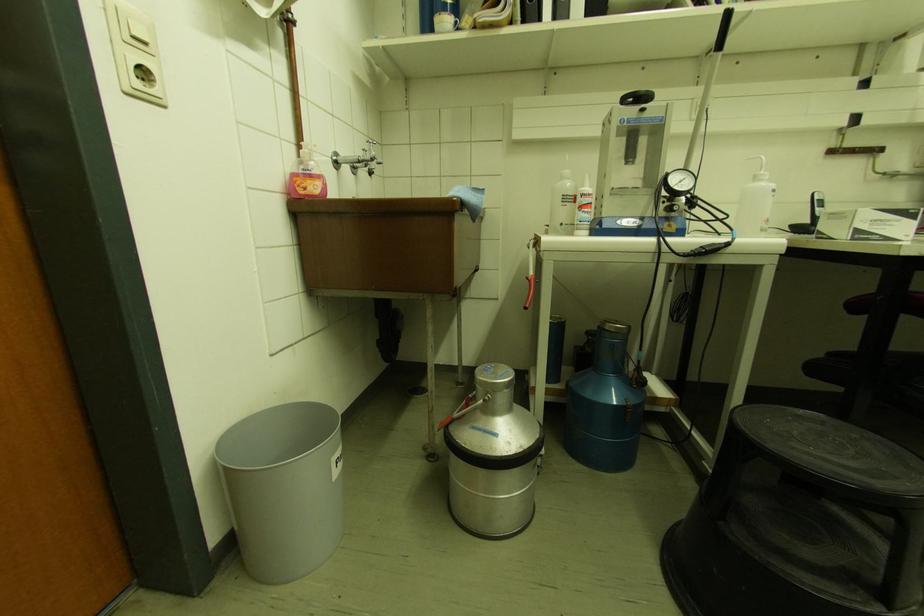
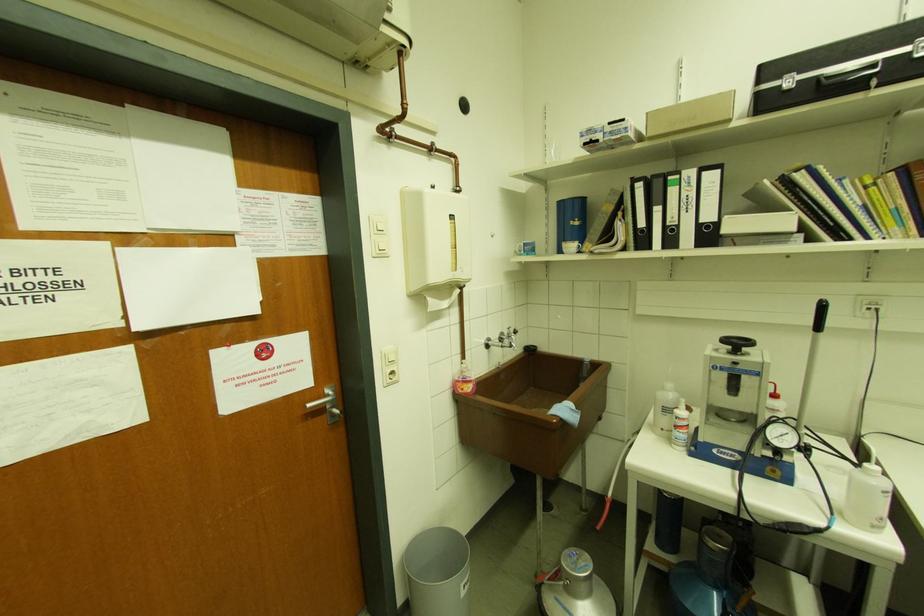
In the second image, find the point that corresponds to (339,474) in the first image.

(467, 594)